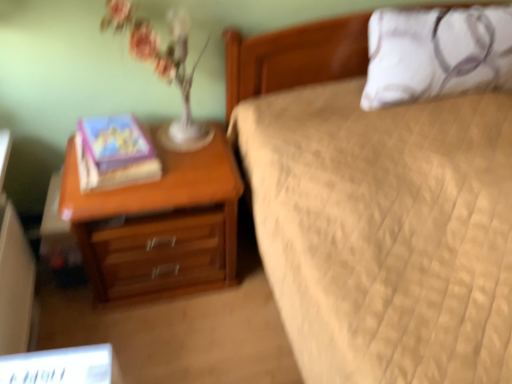
The width and height of the screenshot is (512, 384). Find the location of `vacant space situated above matte purple book at left (from a real-world perspective)`. vacant space situated above matte purple book at left (from a real-world perspective) is located at coordinates click(x=125, y=156).